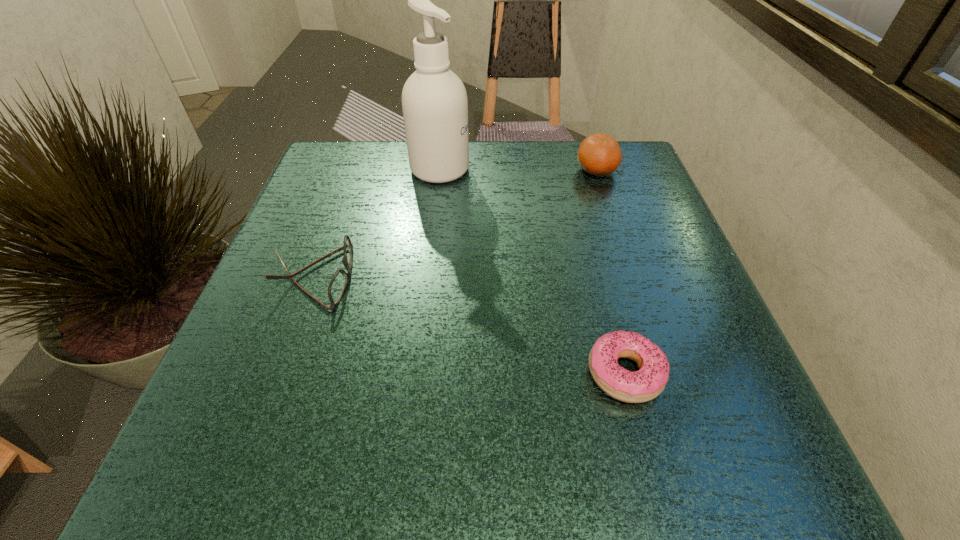
I want to click on the third object from right to left, so click(x=434, y=101).

Locate an element on the screen. This screenshot has width=960, height=540. cleansing agent is located at coordinates (434, 101).

Image resolution: width=960 pixels, height=540 pixels. I want to click on the third shortest object, so click(x=599, y=154).

This screenshot has width=960, height=540. In order to click on spectacles in this screenshot , I will do `click(338, 283)`.

Where is `the third farthest object`? the third farthest object is located at coordinates (338, 283).

You are a GUI agent. You are given a task and a screenshot of the screen. Output one action in this format:
    pyautogui.click(x=<x>, y=<y>)
    Task: Click on the doughnut
    This screenshot has height=540, width=960.
    Given the screenshot: What is the action you would take?
    [x=649, y=381]

Locate an element on the screen. free location located on the front label of the third object from right to left is located at coordinates (554, 169).

You are a GUI agent. You are given a task and a screenshot of the screen. Output one action in this format:
    pyautogui.click(x=<x>, y=<y>)
    Task: Click on the vacant space located 0.380m on the left of the second tallest object
    The width and height of the screenshot is (960, 540).
    Given the screenshot: What is the action you would take?
    pyautogui.click(x=413, y=170)

Locate an element on the screen. The height and width of the screenshot is (540, 960). free space located 0.290m on the front-facing side of the leftmost object is located at coordinates (513, 278).

In order to click on free space located 0.370m on the left of the nearest object in this screenshot , I will do `click(338, 373)`.